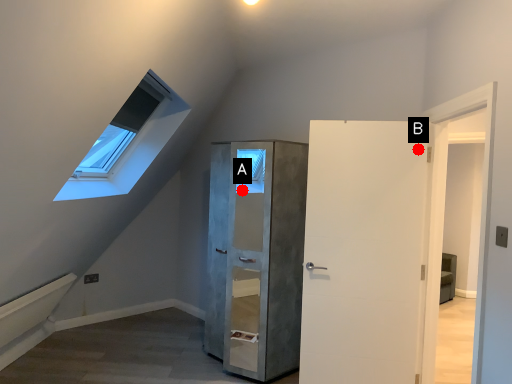
Question: Two points are circled on the image, labeled by A and B beside each circle. Which of the following is the closest to the observer?

Choices:
 (A) A is closer
 (B) B is closer

Answer: (B)